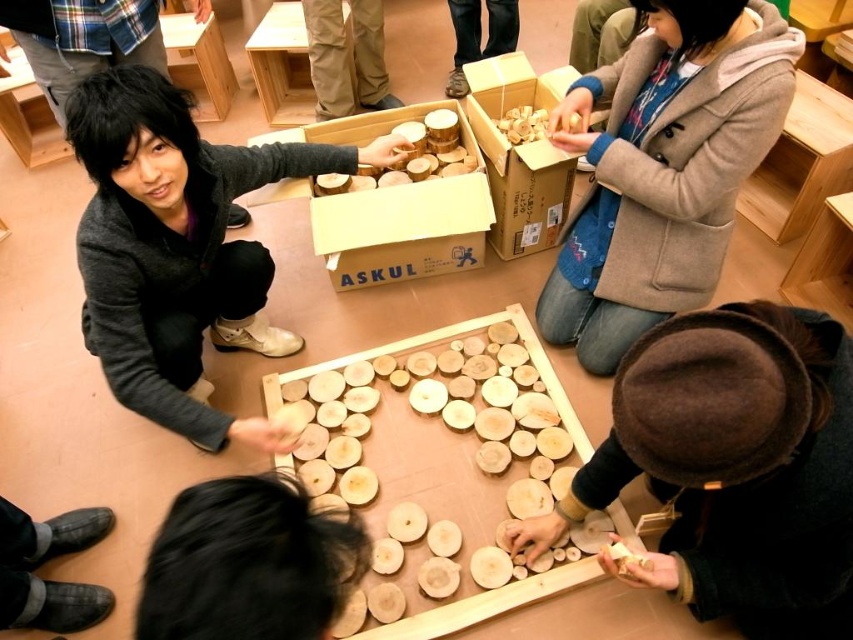
Find the location of a particular element. light brown woolen coat at upper right is located at coordinates (663, 168).

Is light brown woolen coat at upper right wider than brown cardboard box at center?

Indeed, light brown woolen coat at upper right has a greater width compared to brown cardboard box at center.

Is point (692, 273) farther from viewer compared to point (525, 218)?

No, it is in front of (525, 218).

This screenshot has width=853, height=640. I want to click on light brown woolen coat at upper right, so click(x=663, y=168).

Does dark brown hair at lower center appear on the left side of brown cardboard box at center?

Indeed, dark brown hair at lower center is positioned on the left side of brown cardboard box at center.

Who is taller, dark brown hair at lower center or brown cardboard box at center?

With more height is brown cardboard box at center.

Locate an element on the screen. Image resolution: width=853 pixels, height=640 pixels. dark brown hair at lower center is located at coordinates (248, 563).

Where is `dark brown hair at lower center`? The image size is (853, 640). dark brown hair at lower center is located at coordinates (248, 563).

Does brown felt hat at lower right have a greater height compared to natural wood box at center?

Yes, brown felt hat at lower right is taller than natural wood box at center.

Between brown felt hat at lower right and natural wood box at center, which one is positioned higher?

natural wood box at center is higher up.

Identify the location of brown felt hat at lower right. (735, 467).